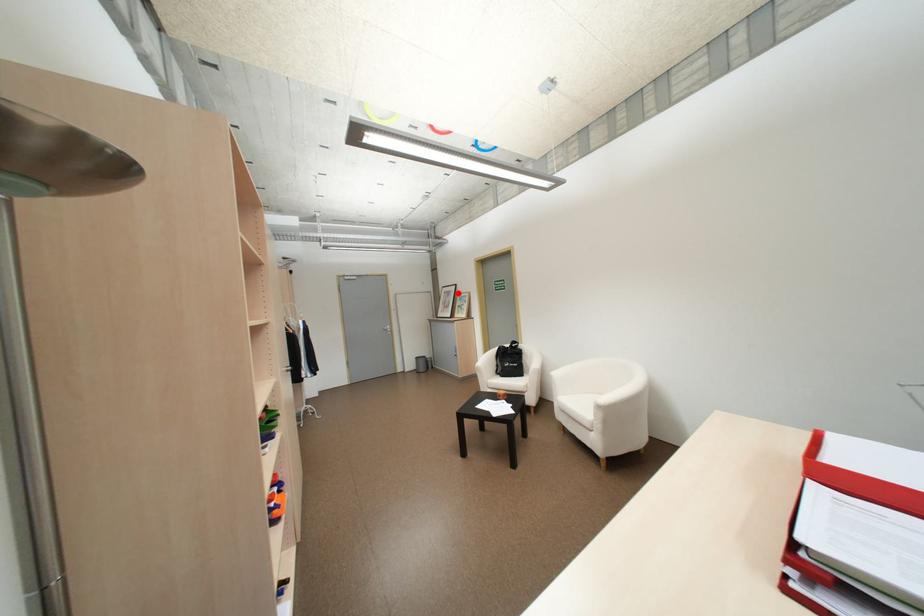
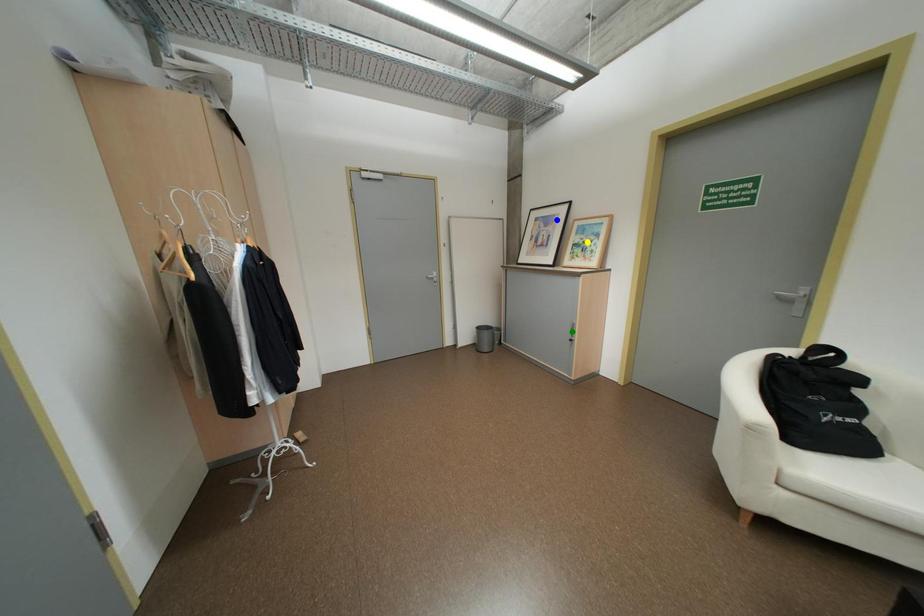
Question: I am providing you with two images of the same scene from different viewpoints. A red point is marked on the first image. You are given multiple points on the second image. Which point in image 2 represents the same 3d spot as the red point in image 1?

Choices:
 (A) blue point
 (B) yellow point
 (C) green point

Answer: (A)